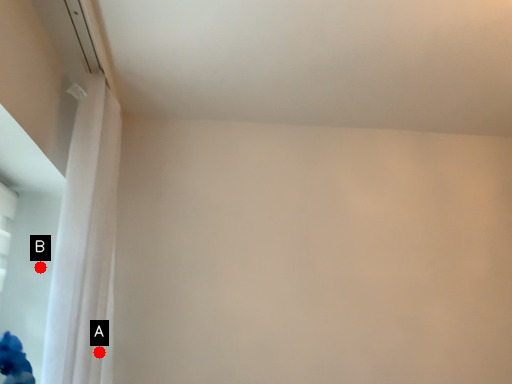
Question: Two points are circled on the image, labeled by A and B beside each circle. Which of the following is the closest to the observer?

Choices:
 (A) A is closer
 (B) B is closer

Answer: (A)